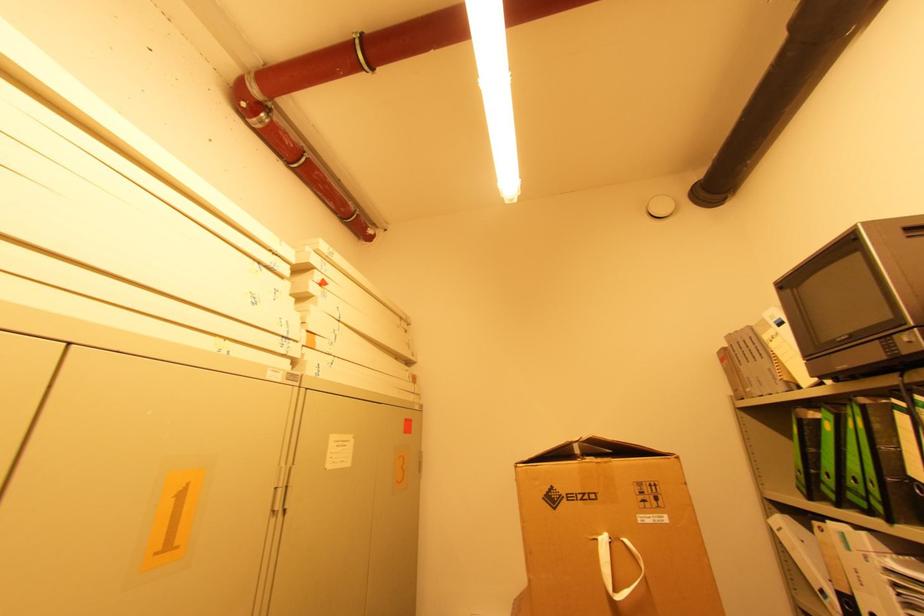
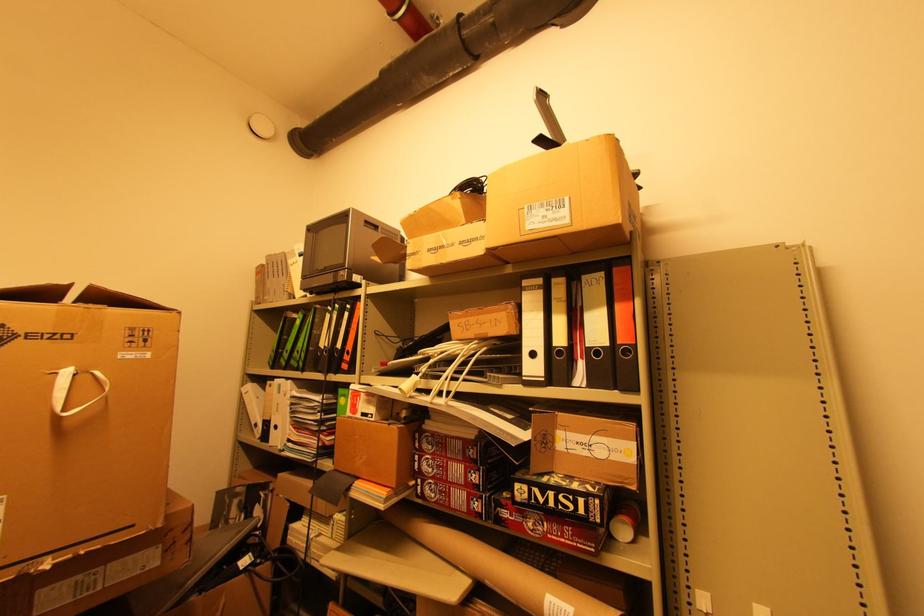
Find the pixel in the second image that matches [630,541] in the first image.

(101, 373)